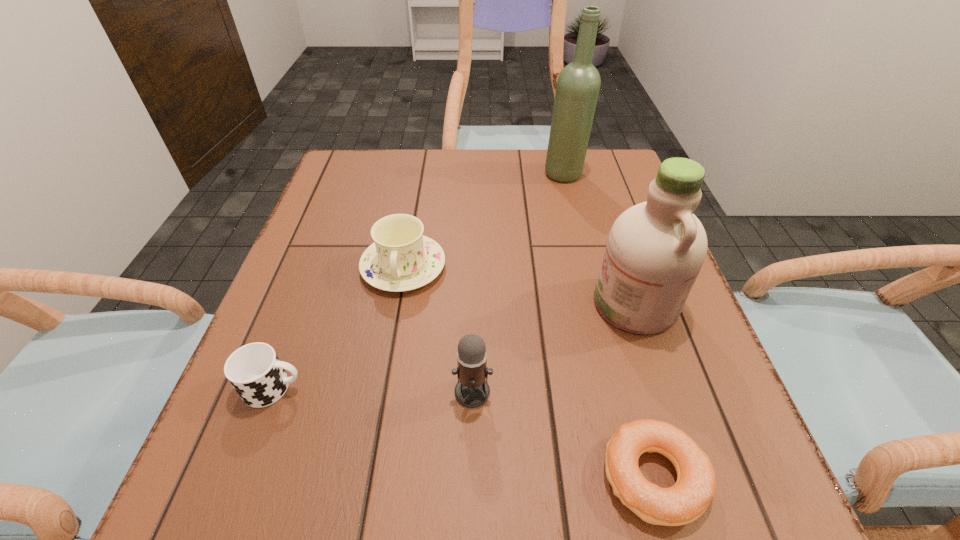
Find the location of `wine bottle`. wine bottle is located at coordinates (578, 84).

This screenshot has height=540, width=960. Identify the location of the farthest object. (578, 84).

Identify the location of cleansing agent. The width and height of the screenshot is (960, 540). (655, 250).

Locate an element on the screen. The width and height of the screenshot is (960, 540). the fourth shortest object is located at coordinates (472, 390).

Identify the location of the third object from left to right. (472, 390).

Where is `the second object from left to right`? the second object from left to right is located at coordinates (401, 259).

Locate an element on the screen. chinaware is located at coordinates (401, 259).

In order to click on cup in this screenshot , I will do `click(254, 370)`.

The height and width of the screenshot is (540, 960). I want to click on the leftmost object, so point(254,370).

The width and height of the screenshot is (960, 540). Identify the location of the shortest object. (687, 500).